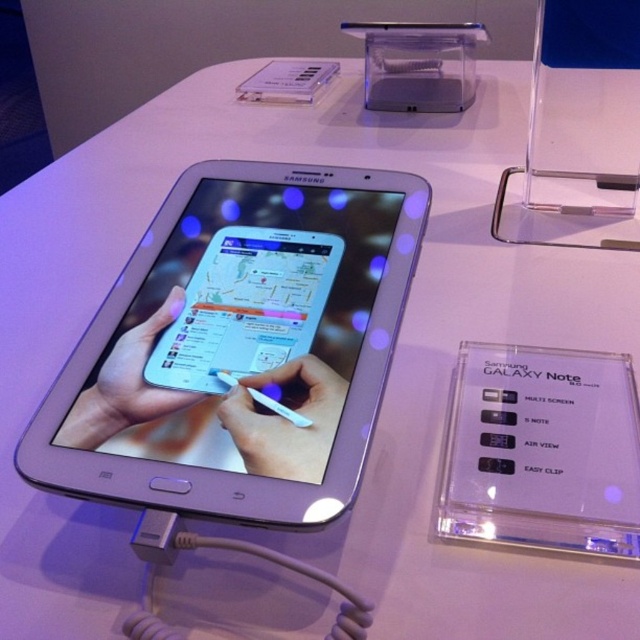
Question: Does silver metallic tablet at center come behind clear plastic samsung galaxy note at center?

Choices:
 (A) no
 (B) yes

Answer: (A)

Question: Which point is closer to the camera?

Choices:
 (A) silver metallic tablet at center
 (B) clear plastic samsung galaxy note at center

Answer: (A)

Question: Is silver metallic tablet at center closer to the viewer compared to clear plastic samsung galaxy note at center?

Choices:
 (A) yes
 (B) no

Answer: (A)

Question: Which of the following is the closest to the observer?

Choices:
 (A) clear plastic samsung galaxy note at center
 (B) silver metallic tablet at center

Answer: (B)

Question: Is silver metallic tablet at center further to camera compared to clear plastic samsung galaxy note at center?

Choices:
 (A) yes
 (B) no

Answer: (B)